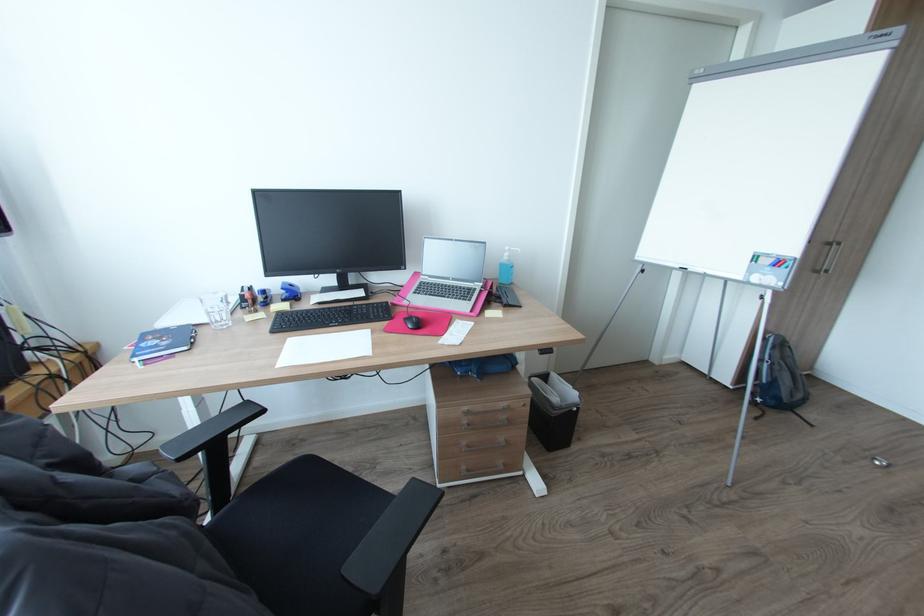
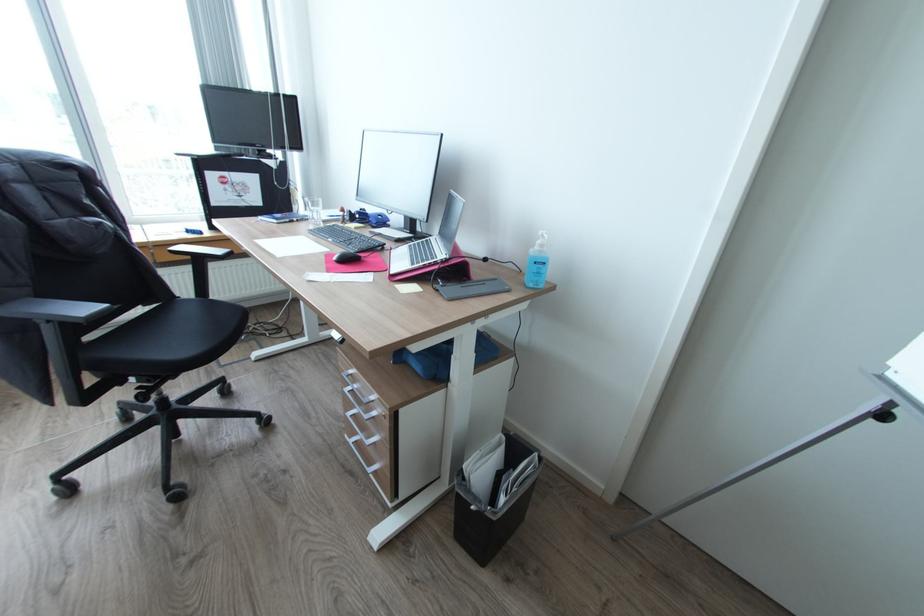
Find the pixel in the second image that matches (x=514, y=256) in the first image.

(545, 245)